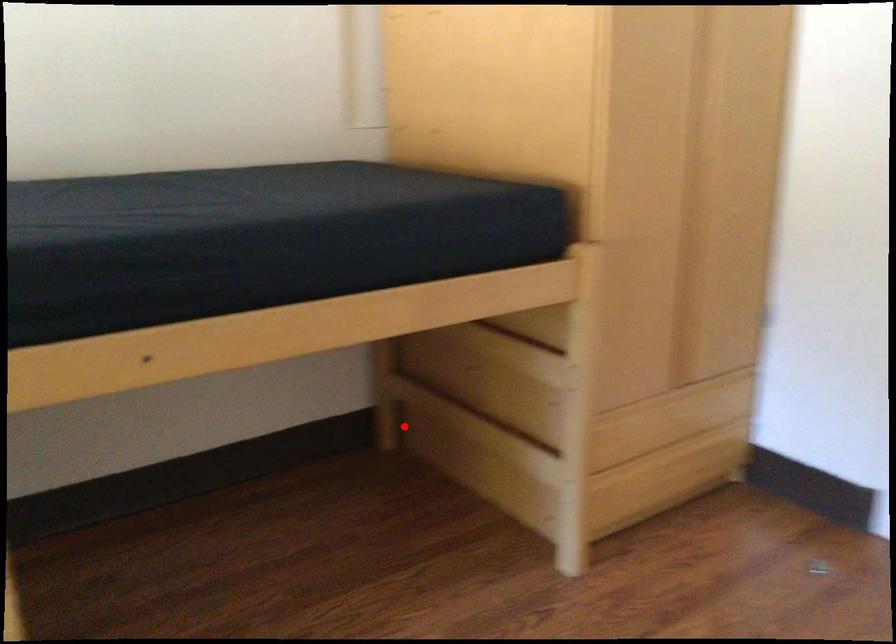
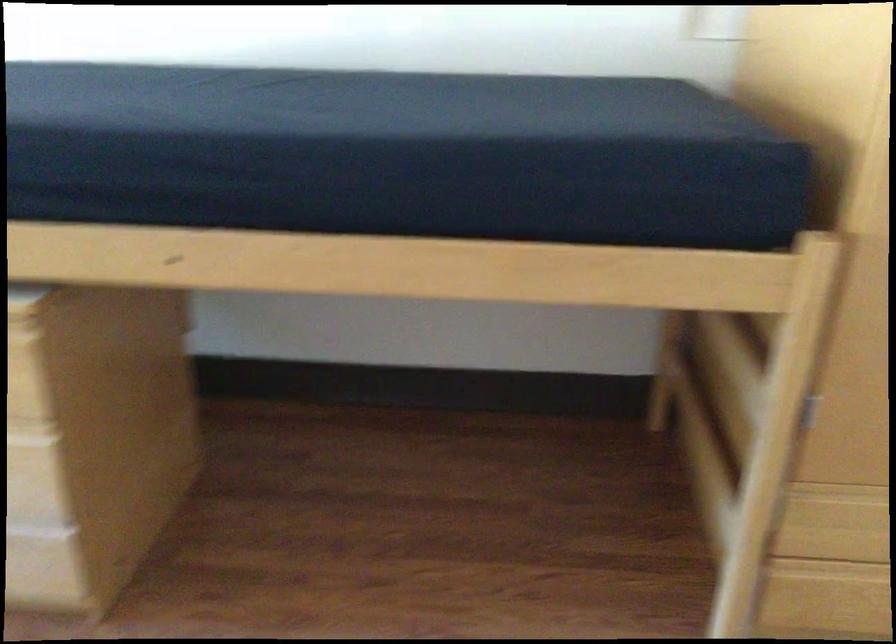
Question: I am providing you with two images of the same scene from different viewpoints. In image1, a red point is highlighted. Considering the same 3D point in image2, which of the following is correct?

Choices:
 (A) It is closer
 (B) It is farther

Answer: (A)